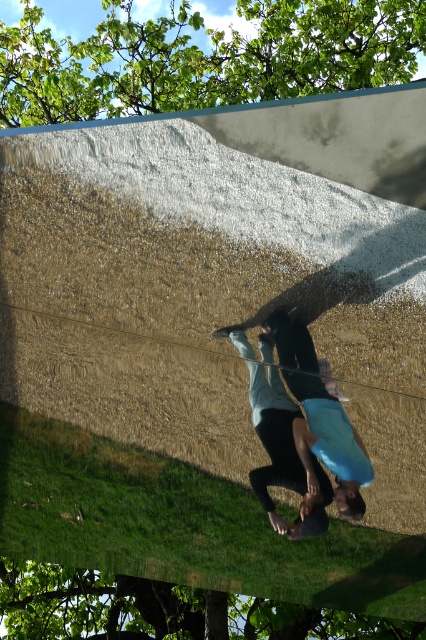
Question: Is green leafy tree at upper center above green leafy tree at upper left?

Choices:
 (A) no
 (B) yes

Answer: (B)

Question: Does green leafy tree at upper center appear on the right side of blue matte surfboard at center?

Choices:
 (A) no
 (B) yes

Answer: (A)

Question: Which point is farther to the camera?

Choices:
 (A) (69, 628)
 (B) (365, 452)

Answer: (A)

Question: Which point is farther to the camera?

Choices:
 (A) green leafy tree at upper left
 (B) blue matte surfboard at center
 (C) green leafy tree at upper center

Answer: (C)

Question: Can you confirm if green leafy tree at upper left is positioned to the left of blue matte surfboard at center?

Choices:
 (A) no
 (B) yes

Answer: (B)

Question: Which of the following is the farthest from the observer?

Choices:
 (A) (307, 70)
 (B) (310, 381)
 (C) (253, 358)
 (D) (157, 580)

Answer: (A)